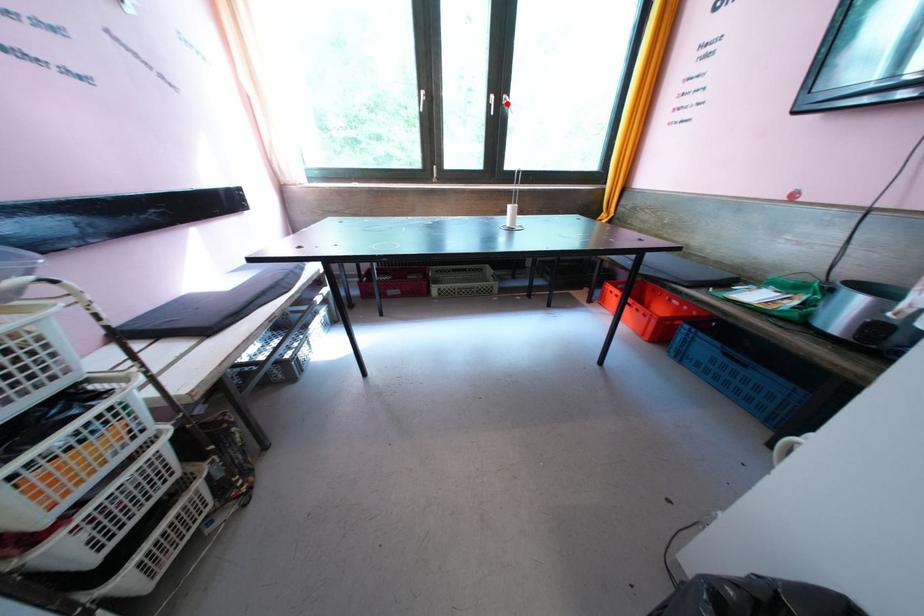
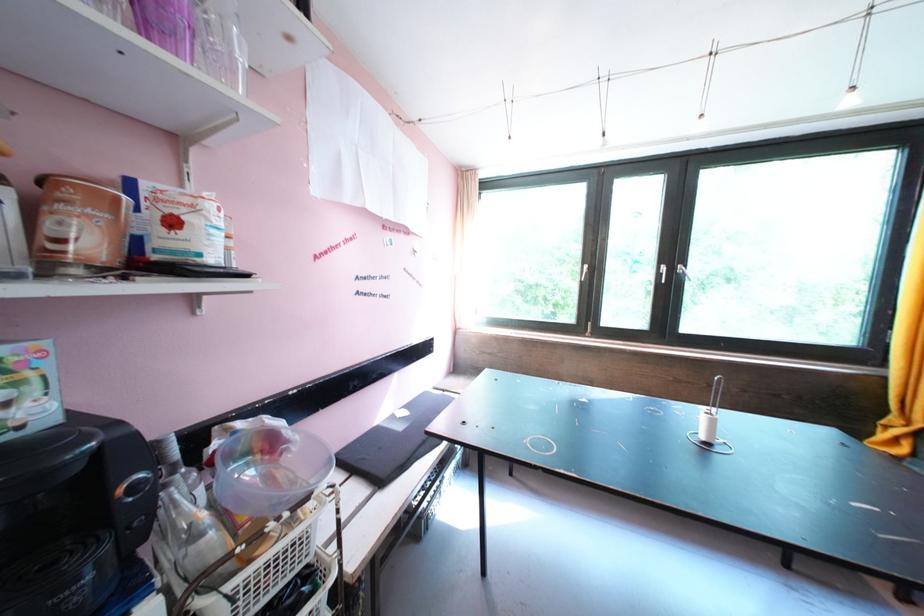
Find the pixel in the second image that matches the highlighted location in the first image.

(679, 273)